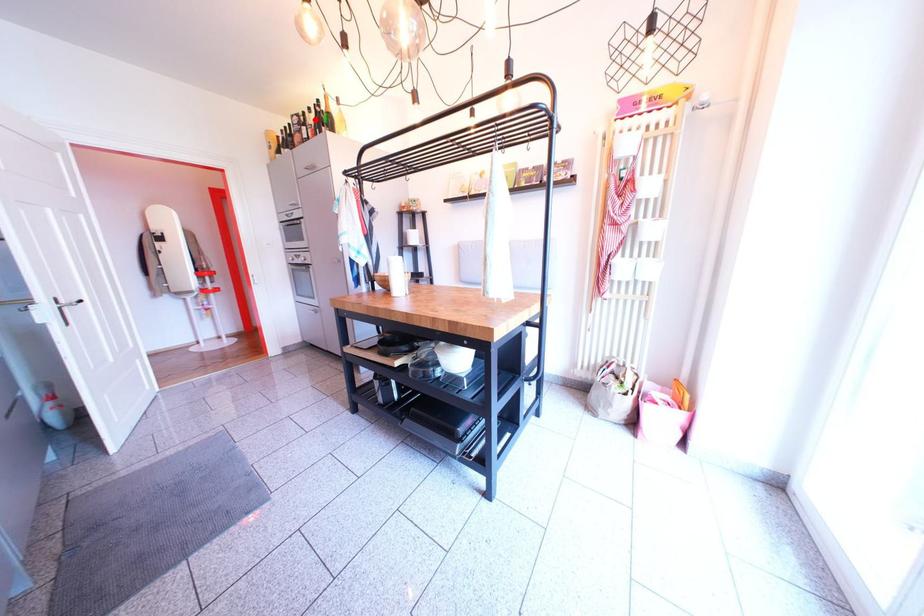
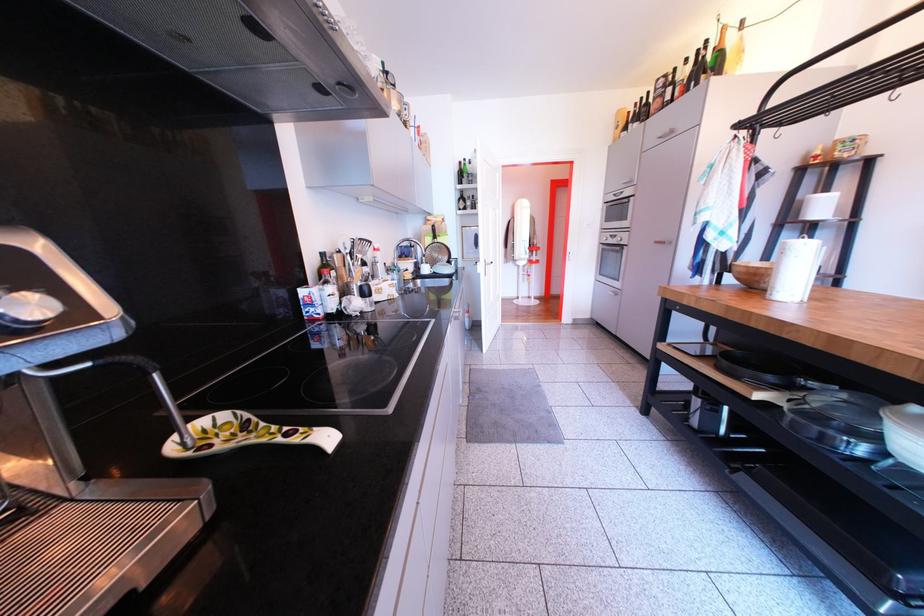
The point at the highlighted location is marked in the first image. Where is the corresponding point in the second image?

(687, 75)